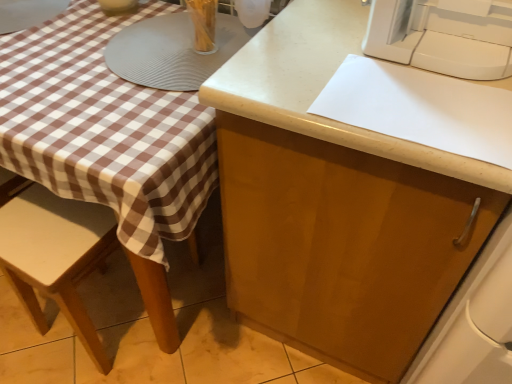
Question: Does wooden chair at lower left turn towards matte wood cabinet at center?

Choices:
 (A) yes
 (B) no

Answer: (B)

Question: Does wooden chair at lower left have a smaller size compared to matte wood cabinet at center?

Choices:
 (A) yes
 (B) no

Answer: (A)

Question: Does wooden chair at lower left have a lesser height compared to matte wood cabinet at center?

Choices:
 (A) yes
 (B) no

Answer: (A)

Question: From a real-world perspective, is wooden chair at lower left below matte wood cabinet at center?

Choices:
 (A) yes
 (B) no

Answer: (A)

Question: Is wooden chair at lower left behind matte wood cabinet at center?

Choices:
 (A) yes
 (B) no

Answer: (A)

Question: From a real-world perspective, is wooden chair at lower left positioned over matte wood cabinet at center based on gravity?

Choices:
 (A) no
 (B) yes

Answer: (A)

Question: Can you confirm if wooden chair at lower left is taller than white plastic sewing machine at upper right?

Choices:
 (A) no
 (B) yes

Answer: (B)

Question: Is wooden chair at lower left outside of white plastic sewing machine at upper right?

Choices:
 (A) yes
 (B) no

Answer: (A)

Question: From a real-world perspective, does wooden chair at lower left sit lower than white plastic sewing machine at upper right?

Choices:
 (A) yes
 (B) no

Answer: (A)

Question: Is wooden chair at lower left smaller than white plastic sewing machine at upper right?

Choices:
 (A) yes
 (B) no

Answer: (B)

Question: Does wooden chair at lower left appear on the right side of white plastic sewing machine at upper right?

Choices:
 (A) no
 (B) yes

Answer: (A)

Question: Is white plastic sewing machine at upper right at the back of wooden chair at lower left?

Choices:
 (A) yes
 (B) no

Answer: (B)

Question: Would you say matte wood cabinet at center is outside wooden chair at lower left?

Choices:
 (A) no
 (B) yes

Answer: (B)